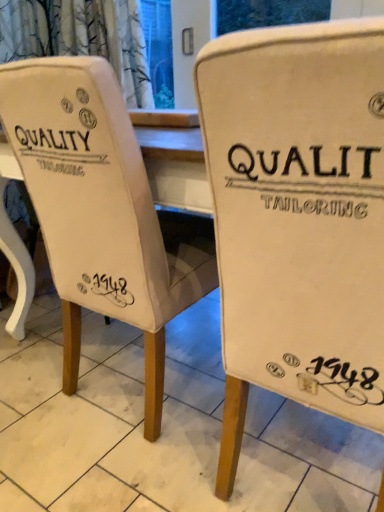
This screenshot has width=384, height=512. What are the coordinates of `free point to the left of white fabric chair at center, the first chair in the left-to-right sequence` in the screenshot? It's located at (33, 367).